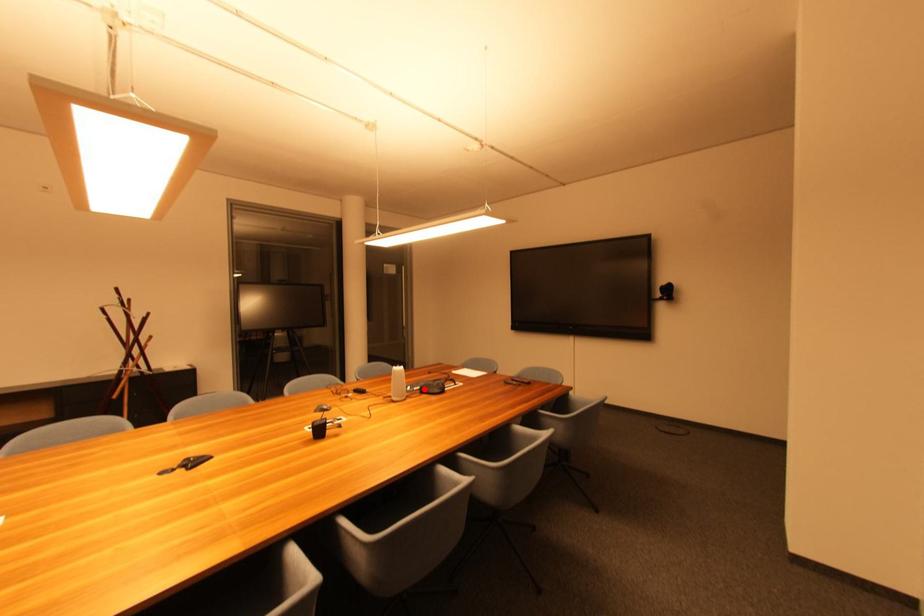
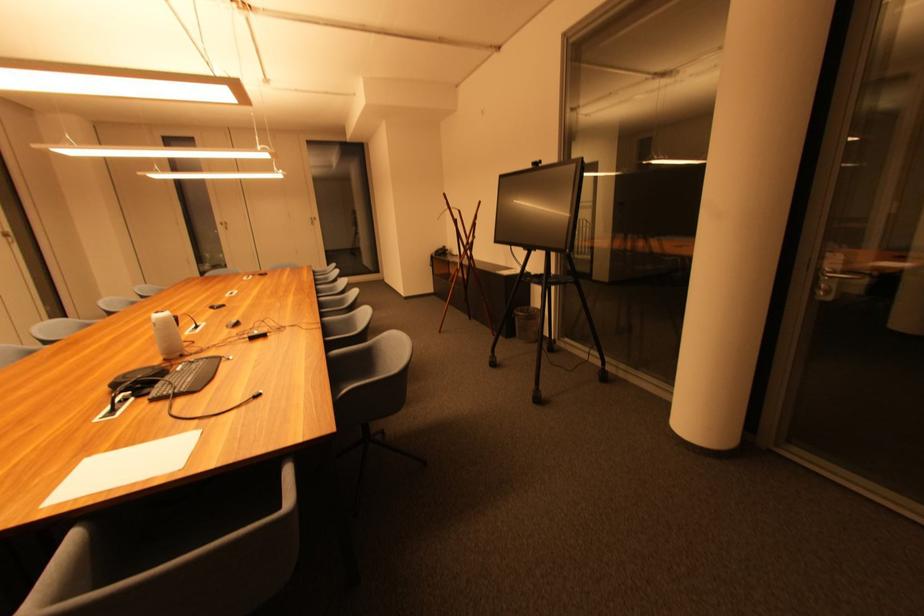
Where in the second image is the point corresponding to the highlighted location from the first image?

(184, 371)